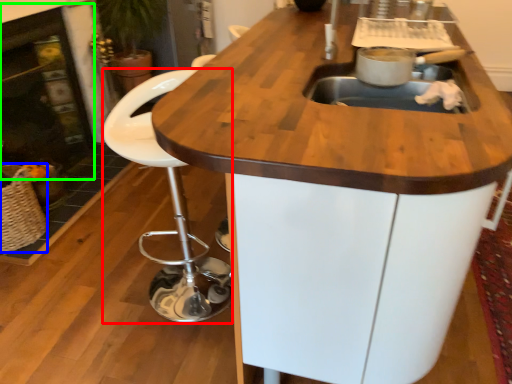
Question: Considering the real-world distances, which object is closest to chair (highlighted by a red box)? basket (highlighted by a blue box) or fireplace (highlighted by a green box).

Choices:
 (A) basket
 (B) fireplace

Answer: (A)